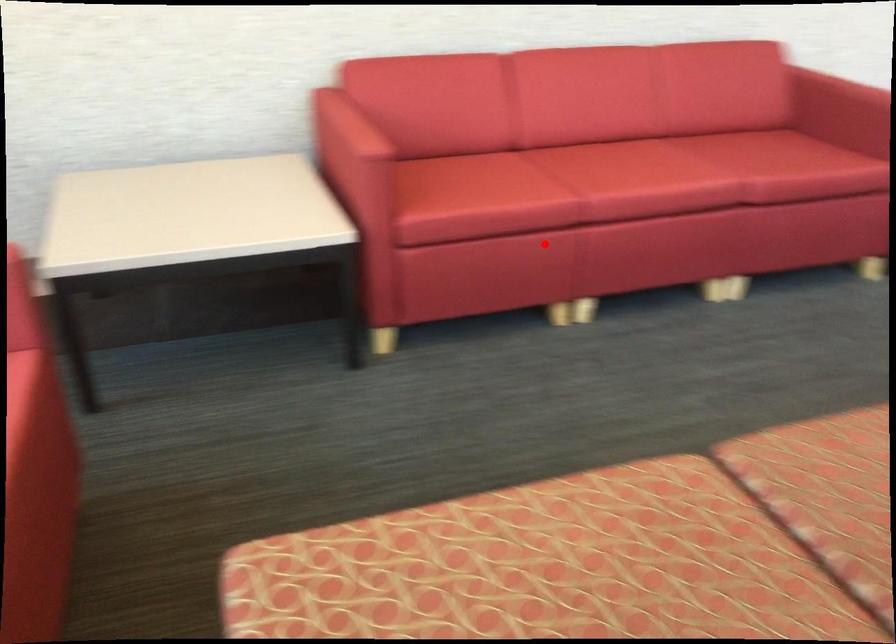
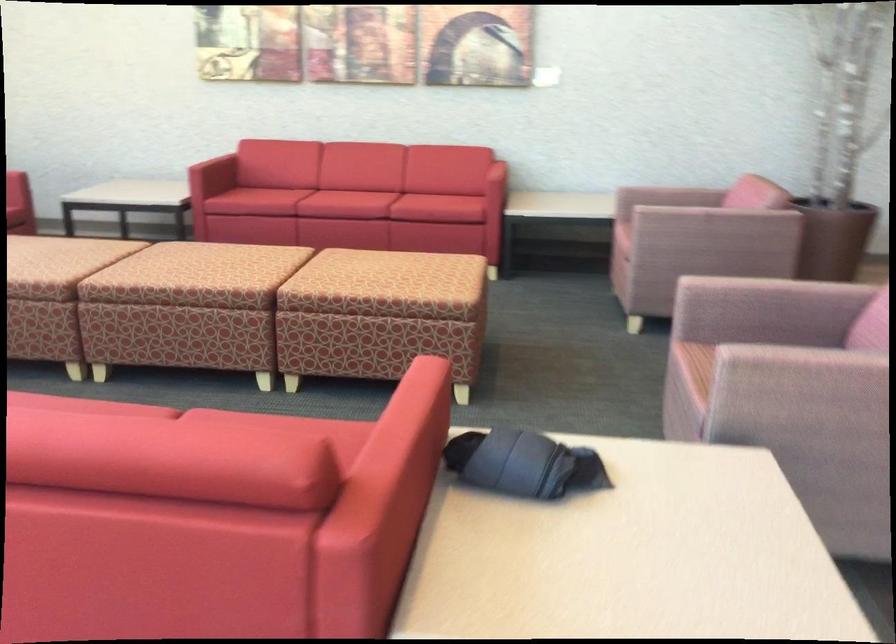
Question: I am providing you with two images of the same scene from different viewpoints. In image1, a red point is highlighted. Considering the same 3D point in image2, which of the following is correct?

Choices:
 (A) It is closer
 (B) It is farther

Answer: (B)